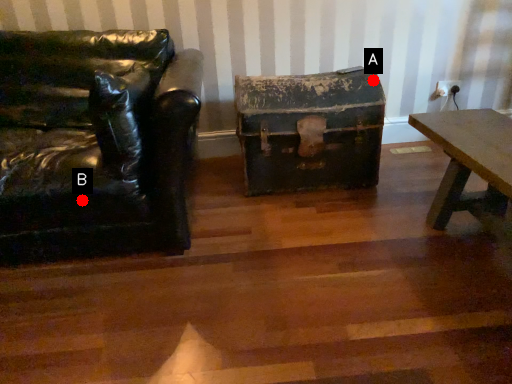
Question: Two points are circled on the image, labeled by A and B beside each circle. Which point is farther to the camera?

Choices:
 (A) A is further
 (B) B is further

Answer: (A)